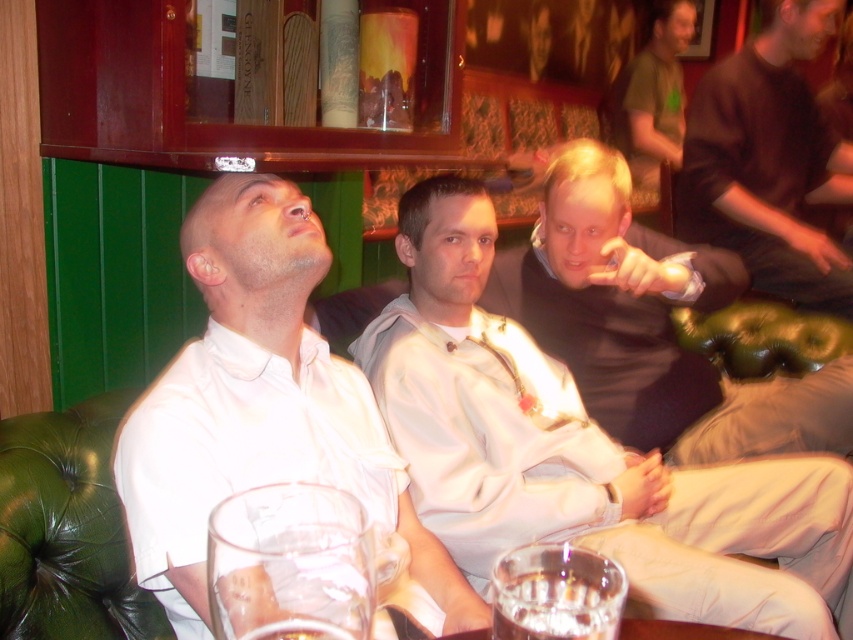
You are standing at the point labeled as point (241, 417) in the image. You want to move to the couch where the three men are sitting. Can you walk straight ahead from your current position to reach the couch without any obstacles?

The distance between you and the viewer is 3.43 feet, so you can walk straight ahead from point (241, 417) to the couch as there are no mentioned obstacles in the scene description.